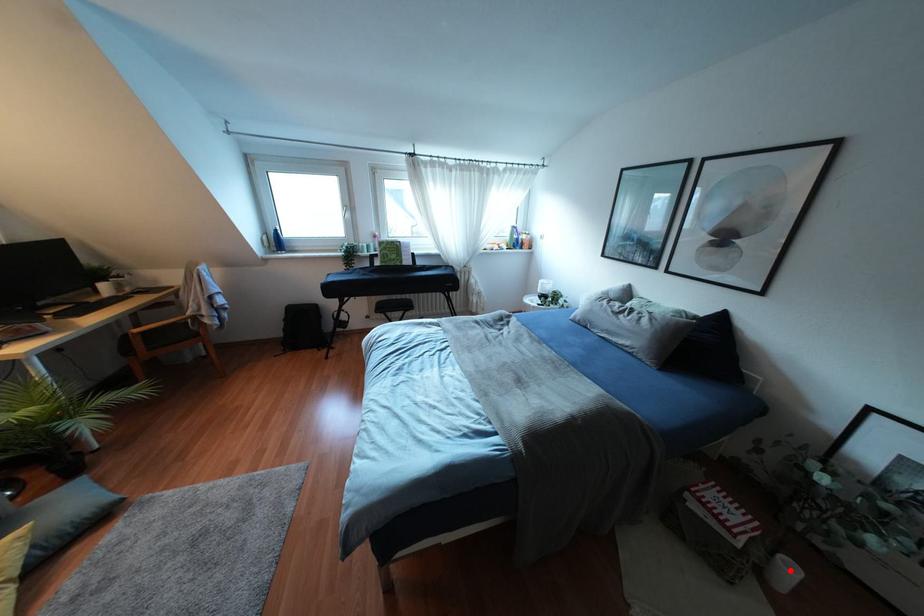
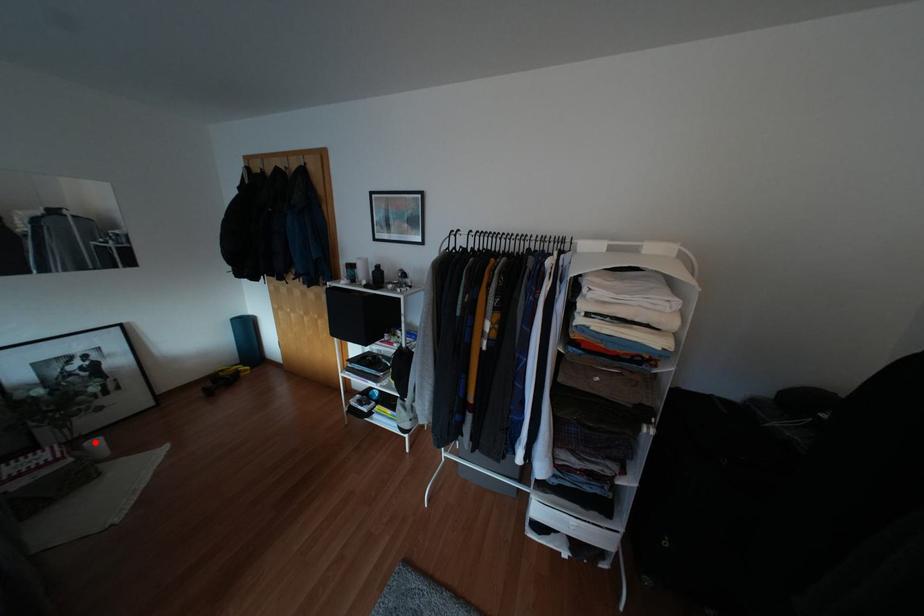
I am providing you with two images of the same scene from different viewpoints. A red point is marked on the first image and another point is marked on the second image. Do the highlighted points in image1 and image2 indicate the same real-world spot?

Yes